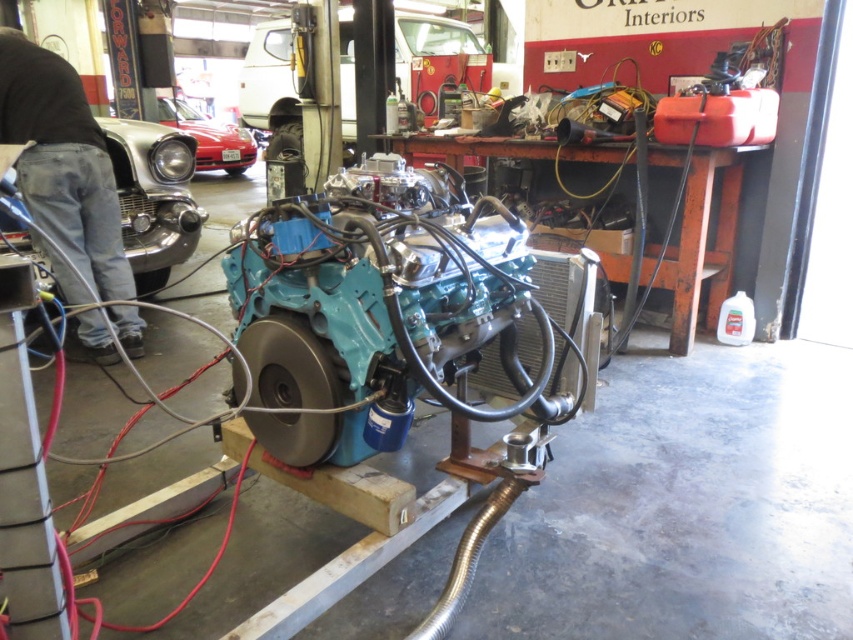
Question: Which object is closer to the camera taking this photo?

Choices:
 (A) metallic silver car at upper center
 (B) shiny red car at center

Answer: (A)

Question: Is denim jeans at left smaller than shiny red car at center?

Choices:
 (A) no
 (B) yes

Answer: (B)

Question: Which object is farther from the camera taking this photo?

Choices:
 (A) shiny silver car at left
 (B) shiny red car at center
 (C) metallic silver car at upper center

Answer: (B)

Question: Can you confirm if denim jeans at left is smaller than shiny silver car at left?

Choices:
 (A) no
 (B) yes

Answer: (A)

Question: Can you confirm if denim jeans at left is positioned to the left of metallic silver car at upper center?

Choices:
 (A) no
 (B) yes

Answer: (A)

Question: Which point is closer to the camera taking this photo?

Choices:
 (A) (167, 228)
 (B) (294, 134)

Answer: (A)